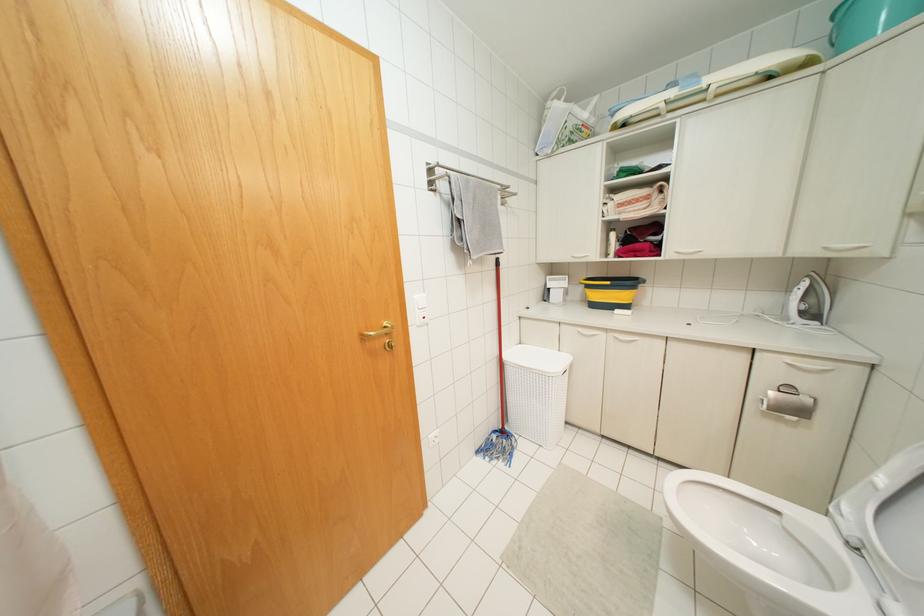
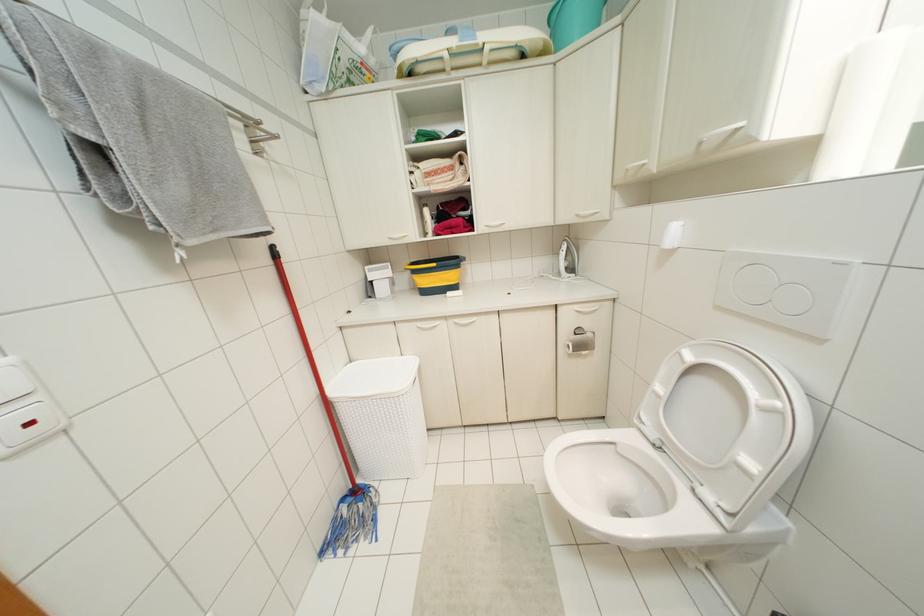
Where in the second image is the point corresponding to [496,259] from the first image?

(273, 246)